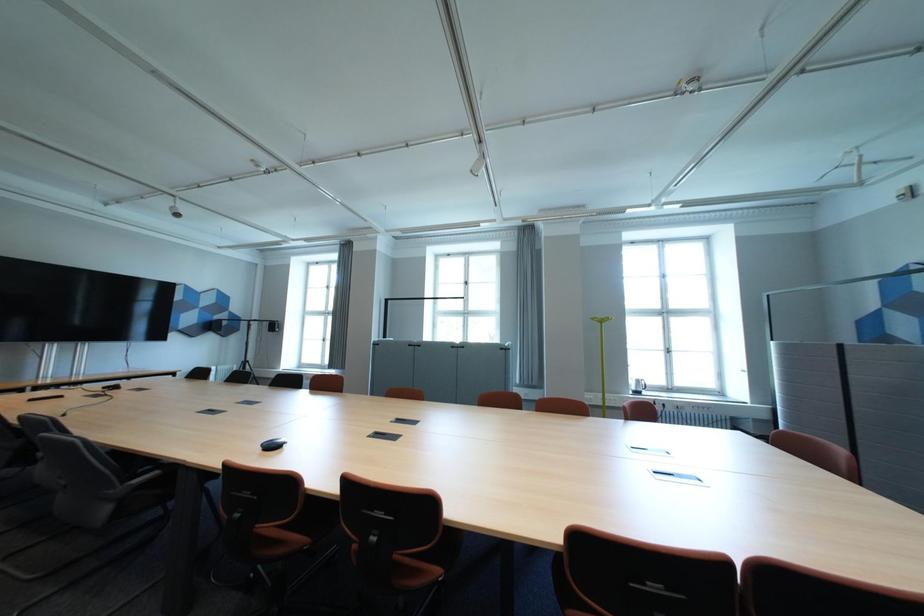
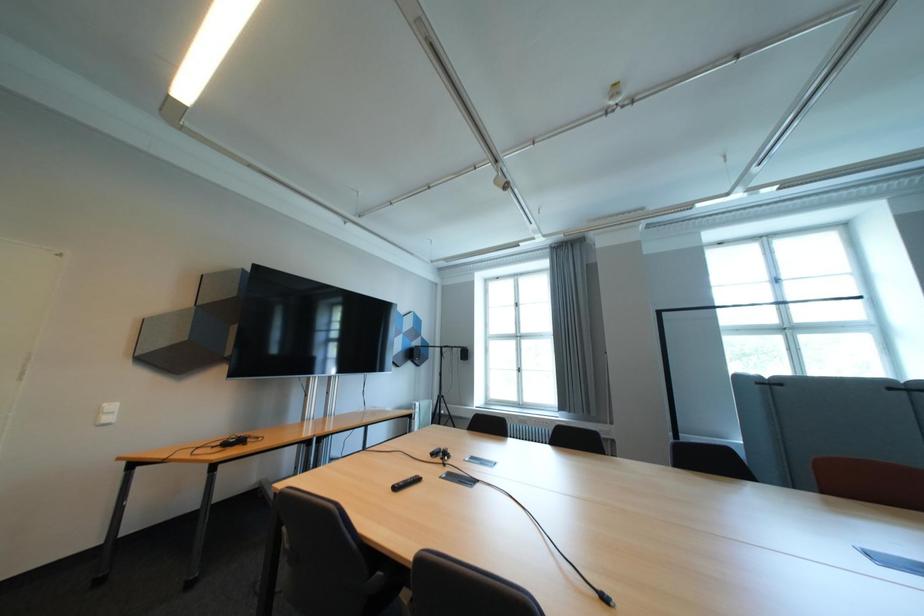
Question: In a continuous first-person perspective shot, in which direction is the camera moving?

Choices:
 (A) Left
 (B) Right
 (C) Forward
 (D) Backward

Answer: (A)